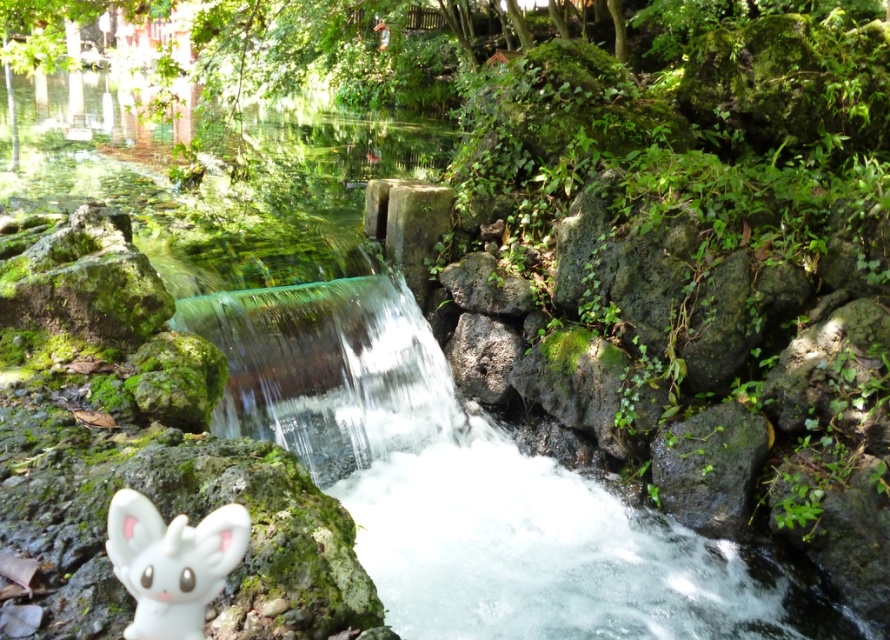
You are a maintenance worker who needs to reach the white matte plush at lower left to clean it. The path to it is slippery due to the waterfall spray. If you can only move 1 meter in any direction without slipping, can you safely reach it from your current position?

The distance between you and the white matte plush at lower left is 1.20 meters, which is beyond your safe movement range of 1 meter. Therefore, you cannot safely reach it without slipping.